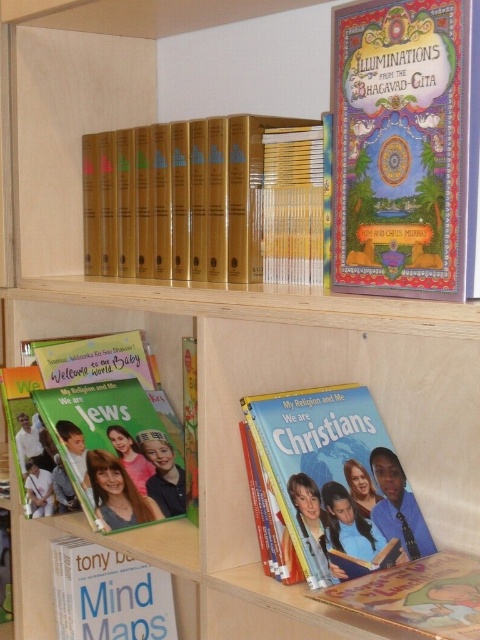
You are organizing books on a shelf and notice the hardcover book at lower right and the yellow hardcover book at center. Which book should you move to the left to make space for a new book that needs to be placed on the left side?

The hardcover book at lower right is to the right of the yellow hardcover book at center, so you should move the hardcover book at lower right to the left to make space for the new book on the left side.

You are a librarian organizing books on a shelf. You have a matte green book at lower left and a yellow hardcover book at center. Which book should you place first if you want to arrange them from largest to smallest?

The matte green book at lower left is bigger than the yellow hardcover book at center, so you should place the matte green book at lower left first when arranging from largest to smallest.

You are standing in front of the bookshelf and want to reach two points. The first point is at the location of point (389,618) and the second is at point (301,276). Which point is closer to you?

Point (389,618) is closer to the viewer than point (301,276).